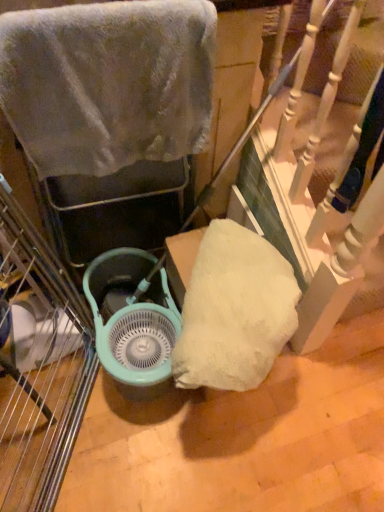
I want to click on fuzzy gray towel at upper left, so click(108, 83).

The width and height of the screenshot is (384, 512). What do you see at coordinates (108, 83) in the screenshot?
I see `fuzzy gray towel at upper left` at bounding box center [108, 83].

Measure the distance between point (109,347) and camera.

Point (109,347) is 1.16 meters away from camera.

Locate an element on the screen. teal plastic fan at center is located at coordinates (132, 318).

The height and width of the screenshot is (512, 384). Describe the element at coordinates (132, 318) in the screenshot. I see `teal plastic fan at center` at that location.

You are a GUI agent. You are given a task and a screenshot of the screen. Output one action in this format:
    pyautogui.click(x=<x>, y=<y>)
    Task: Click on the fuzzy gray towel at upper left
    The image size is (384, 512).
    Given the screenshot: What is the action you would take?
    pyautogui.click(x=108, y=83)

Based on the photo, does fuzzy gray towel at upper left appear on the left side of teal plastic fan at center?

No.

In the image, is fuzzy gray towel at upper left positioned in front of or behind teal plastic fan at center?

fuzzy gray towel at upper left is positioned closer to the viewer than teal plastic fan at center.

Considering the points (75, 82) and (120, 362), which point is in front, point (75, 82) or point (120, 362)?

Positioned in front is point (75, 82).

From the image's perspective, does fuzzy gray towel at upper left appear higher than teal plastic fan at center?

Yes, from the image's perspective, fuzzy gray towel at upper left is on top of teal plastic fan at center.

From a real-world perspective, between fuzzy gray towel at upper left and teal plastic fan at center, who is vertically lower?

teal plastic fan at center is physically lower.

Which object is wider, fuzzy gray towel at upper left or teal plastic fan at center?

teal plastic fan at center.

Which of these two, fuzzy gray towel at upper left or teal plastic fan at center, stands shorter?

Standing shorter between the two is teal plastic fan at center.

Who is bigger, fuzzy gray towel at upper left or teal plastic fan at center?

Bigger between the two is teal plastic fan at center.

Is fuzzy gray towel at upper left inside the boundaries of teal plastic fan at center, or outside?

fuzzy gray towel at upper left is outside teal plastic fan at center.

Is fuzzy gray towel at upper left far away from teal plastic fan at center?

They are positioned close to each other.

Is fuzzy gray towel at upper left looking in the opposite direction of teal plastic fan at center?

That's not correct — fuzzy gray towel at upper left is not looking away from teal plastic fan at center.

The height and width of the screenshot is (512, 384). Identify the location of fan beneath the fuzzy gray towel at upper left (from a real-world perspective). (132, 318).

Considering the positions of objects teal plastic fan at center and fuzzy gray towel at upper left in the image provided, who is more to the left, teal plastic fan at center or fuzzy gray towel at upper left?

From the viewer's perspective, teal plastic fan at center appears more on the left side.

Which is in front, teal plastic fan at center or fuzzy gray towel at upper left?

fuzzy gray towel at upper left is in front.

Considering the positions of points (87, 286) and (158, 129), is point (87, 286) farther from camera compared to point (158, 129)?

Yes, point (87, 286) is behind point (158, 129).

Consider the image. From the image's perspective, is teal plastic fan at center positioned above or below fuzzy gray towel at upper left?

teal plastic fan at center is situated lower than fuzzy gray towel at upper left in the image.

From a real-world perspective, between teal plastic fan at center and fuzzy gray towel at upper left, who is vertically lower?

From a 3D spatial view, teal plastic fan at center is below.

Which of these two, teal plastic fan at center or fuzzy gray towel at upper left, is wider?

teal plastic fan at center.

Considering the relative sizes of teal plastic fan at center and fuzzy gray towel at upper left in the image provided, is teal plastic fan at center taller than fuzzy gray towel at upper left?

In fact, teal plastic fan at center may be shorter than fuzzy gray towel at upper left.

Who is bigger, teal plastic fan at center or fuzzy gray towel at upper left?

Bigger between the two is teal plastic fan at center.

Can fuzzy gray towel at upper left be found inside teal plastic fan at center?

No, fuzzy gray towel at upper left is not surrounded by teal plastic fan at center.

Is the surface of teal plastic fan at center in direct contact with fuzzy gray towel at upper left?

They are not placed beside each other.

Is teal plastic fan at center looking in the opposite direction of fuzzy gray towel at upper left?

teal plastic fan at center is not turned away from fuzzy gray towel at upper left.

How far apart are teal plastic fan at center and fuzzy gray towel at upper left?

teal plastic fan at center is 19.97 inches away from fuzzy gray towel at upper left.

Locate an element on the screen. fan that is on the left side of fuzzy gray towel at upper left is located at coordinates 132,318.

Locate an element on the screen. fan that appears on the left of fuzzy gray towel at upper left is located at coordinates (132, 318).

The image size is (384, 512). In order to click on towel located above the teal plastic fan at center (from the image's perspective) in this screenshot , I will do pyautogui.click(x=108, y=83).